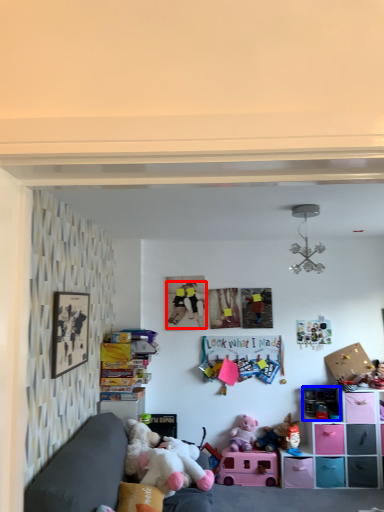
Question: Which point is closer to the camera, person (highlighted by a red box) or toy (highlighted by a blue box)?

Choices:
 (A) person
 (B) toy

Answer: (B)